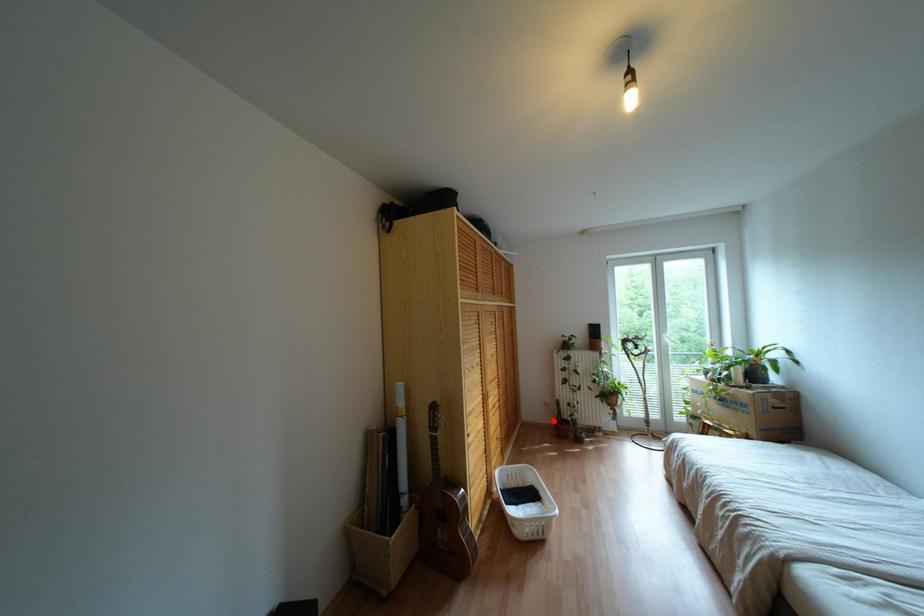
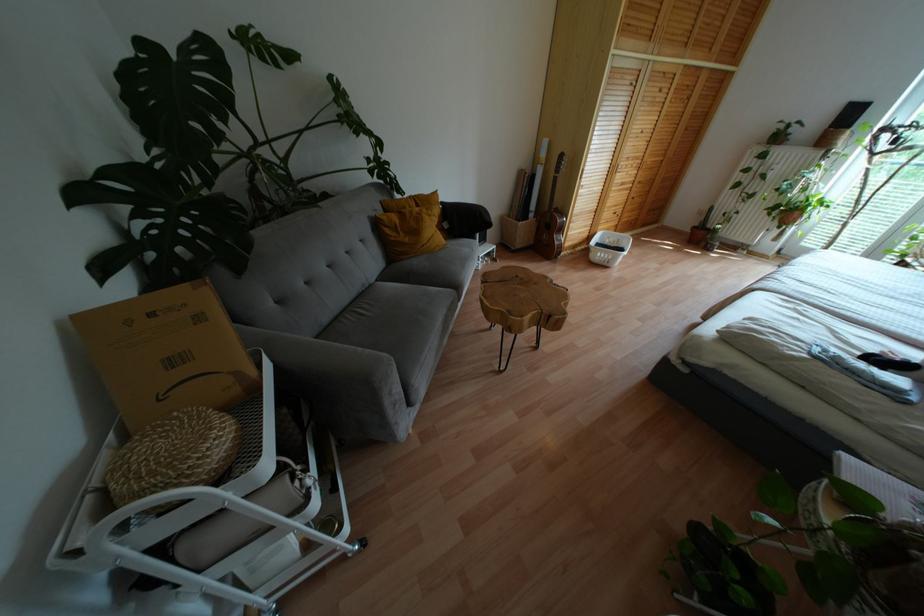
Question: I am providing you with two images of the same scene from different viewpoints. In image1, a red point is highlighted. Considering the same 3D point in image2, which of the following is correct?

Choices:
 (A) It is closer
 (B) It is farther

Answer: (A)